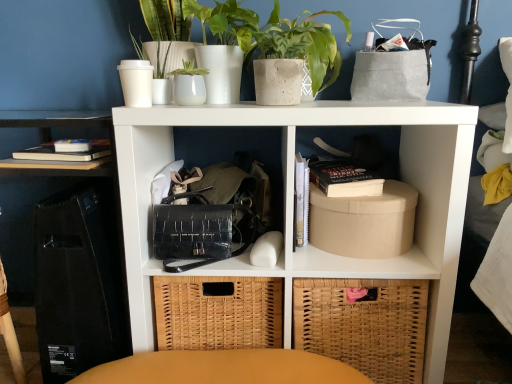
This screenshot has width=512, height=384. Find the location of `vacant point above beige cardboard box at right (from a real-world perspective)`. vacant point above beige cardboard box at right (from a real-world perspective) is located at coordinates tap(379, 187).